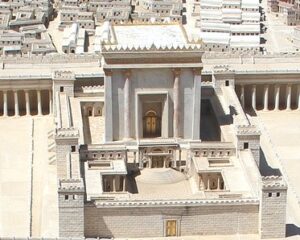
Locate an element on the screen. The height and width of the screenshot is (240, 300). wall is located at coordinates (215, 224).